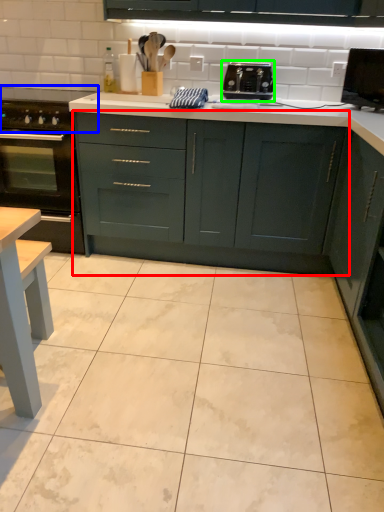
Question: Considering the real-world distances, which object is farthest from cabinetry (highlighted by a red box)? gas stove (highlighted by a blue box) or toaster (highlighted by a green box)?

Choices:
 (A) gas stove
 (B) toaster

Answer: (A)